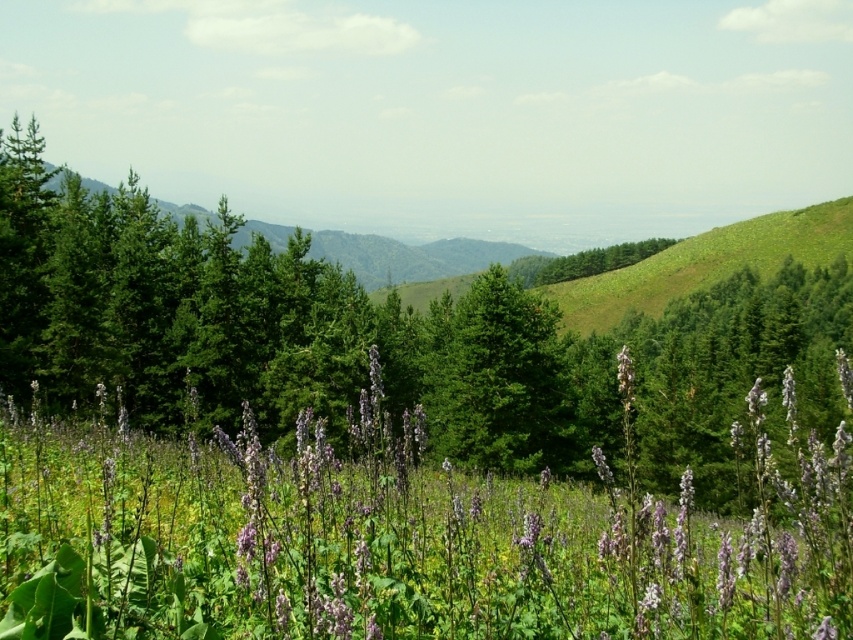
Question: Is purple matte flower at center bigger than green leafy tree at center?

Choices:
 (A) no
 (B) yes

Answer: (A)

Question: Which object is positioned closest to the purple matte flower at center?

Choices:
 (A) green glossy tree at center
 (B) green matte tree at center

Answer: (A)

Question: Which object is positioned farthest from the green leafy tree at center?

Choices:
 (A) purple matte flower at center
 (B) green glossy tree at center
 (C) green matte tree at center

Answer: (A)

Question: Can you confirm if purple matte flower at center is positioned to the right of green leafy tree at center?

Choices:
 (A) no
 (B) yes

Answer: (A)

Question: Which object appears closest to the camera in this image?

Choices:
 (A) green matte tree at center
 (B) purple matte flower at center
 (C) green leafy tree at center
 (D) green glossy tree at center

Answer: (B)

Question: Is purple matte flower at center above green glossy tree at center?

Choices:
 (A) no
 (B) yes

Answer: (A)